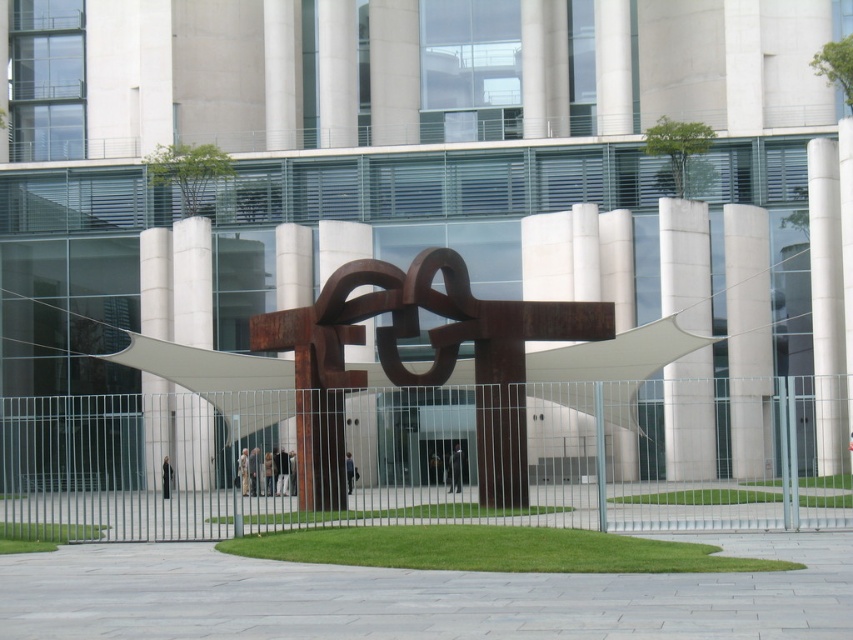
You are a landscape architect designing a pathway between the metallic silver fence at center and the satin white column at center. Given their widths, which object requires more space to accommodate in the design?

The metallic silver fence at center requires more space because its width surpasses that of the satin white column at center.

You are an architect designing a new plaza and want to place a bench between the white concrete pillar at center and the rustic metal pillar at center. Which pillar should the bench be closer to if you want it to be near the larger pillar?

The bench should be placed closer to the white concrete pillar at center since it is larger than the rustic metal pillar at center.

You are standing in front of the modern building and want to take a photo of the two points marked in the image. Which point, point (640, 516) or point (674, 368), is closer to you?

Point (640, 516) is closer to the camera than point (674, 368), so it is closer to you.